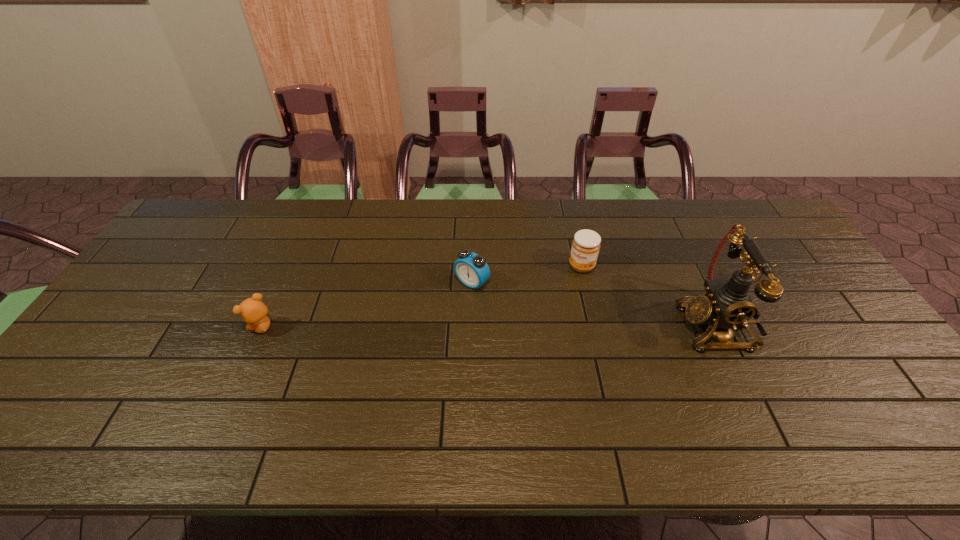
Locate an element on the screen. This screenshot has height=540, width=960. vacant space at the right edge of the desktop is located at coordinates (829, 340).

You are a GUI agent. You are given a task and a screenshot of the screen. Output one action in this format:
    pyautogui.click(x=<x>, y=<y>)
    Task: Click on the vacant space at the far left corner
    This screenshot has height=540, width=960.
    Given the screenshot: What is the action you would take?
    pyautogui.click(x=213, y=215)

The width and height of the screenshot is (960, 540). Find the location of `empty location between the rightmost object and the second object from right to left`. empty location between the rightmost object and the second object from right to left is located at coordinates (648, 296).

You are a GUI agent. You are given a task and a screenshot of the screen. Output one action in this format:
    pyautogui.click(x=<x>, y=<y>)
    Task: Click on the free space between the telephone and the alarm clock
    
    Given the screenshot: What is the action you would take?
    (x=593, y=304)

Locate an element on the screen. The height and width of the screenshot is (540, 960). unoccupied position between the telephone and the second object from right to left is located at coordinates (648, 296).

Locate an element on the screen. This screenshot has height=540, width=960. empty location between the second object from right to left and the teddy bear is located at coordinates (422, 297).

Locate an element on the screen. Image resolution: width=960 pixels, height=540 pixels. free point between the teddy bear and the alarm clock is located at coordinates (368, 305).

The image size is (960, 540). I want to click on vacant area that lies between the third object from right to left and the teddy bear, so click(x=368, y=305).

This screenshot has height=540, width=960. I want to click on vacant space that is in between the third object from right to left and the jam, so click(527, 275).

The image size is (960, 540). I want to click on free spot between the second object from left to right and the teddy bear, so click(x=368, y=305).